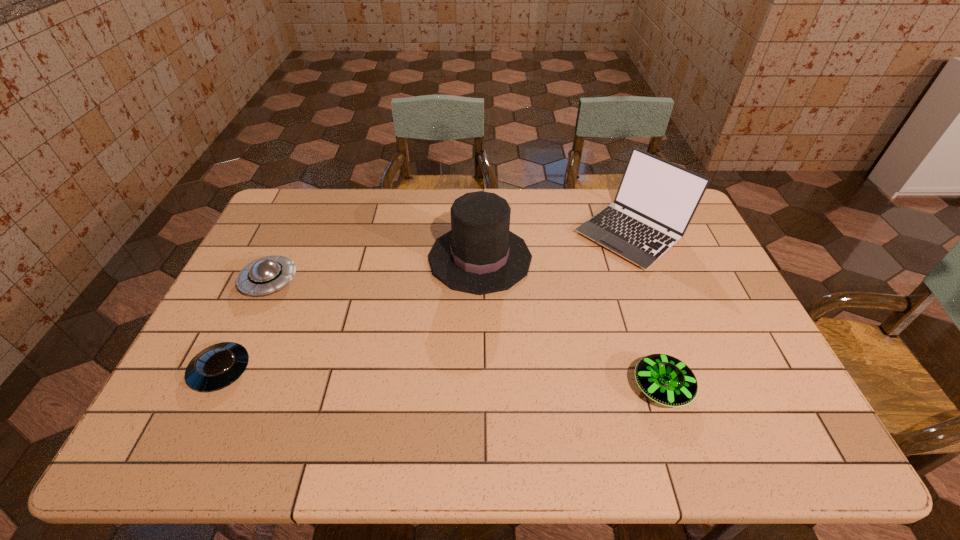
Locate an element on the screen. laptop_computer is located at coordinates (657, 196).

Image resolution: width=960 pixels, height=540 pixels. What are the coordinates of `the third object from right to left` in the screenshot? It's located at pyautogui.click(x=479, y=255).

This screenshot has height=540, width=960. Identify the location of the farthest saucer. (265, 275).

Image resolution: width=960 pixels, height=540 pixels. I want to click on the rightmost saucer, so click(665, 379).

Identify the location of the shortest saucer. (217, 366).

Where is `blank space located at the front screen of the laptop_computer`? Image resolution: width=960 pixels, height=540 pixels. blank space located at the front screen of the laptop_computer is located at coordinates (513, 233).

Where is `free point located at the front screen of the laptop_computer`? free point located at the front screen of the laptop_computer is located at coordinates (541, 233).

You are a GUI agent. You are given a task and a screenshot of the screen. Output one action in this format:
    pyautogui.click(x=<x>, y=<y>)
    Task: Click on the vacant space situated at the front screen of the laptop_computer
    This screenshot has width=960, height=540.
    Given the screenshot: What is the action you would take?
    pyautogui.click(x=483, y=233)

This screenshot has width=960, height=540. Find the location of `free region located on the front of the third object from right to left with the decoration`. free region located on the front of the third object from right to left with the decoration is located at coordinates (347, 258).

This screenshot has width=960, height=540. I want to click on blank area located on the front of the third object from right to left with the decoration, so click(x=372, y=258).